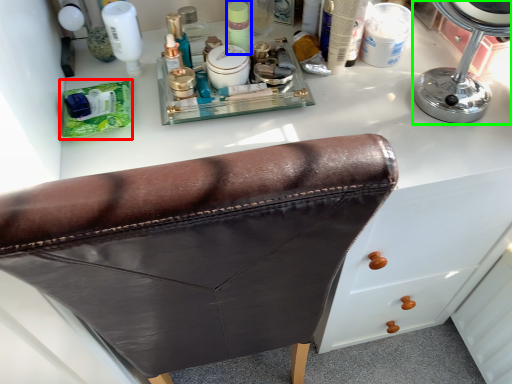
Question: Based on their relative distances, which object is nearer to product (highlighted by a red box)? Choose from toiletry (highlighted by a blue box) and mirror (highlighted by a green box).

Choices:
 (A) toiletry
 (B) mirror

Answer: (A)